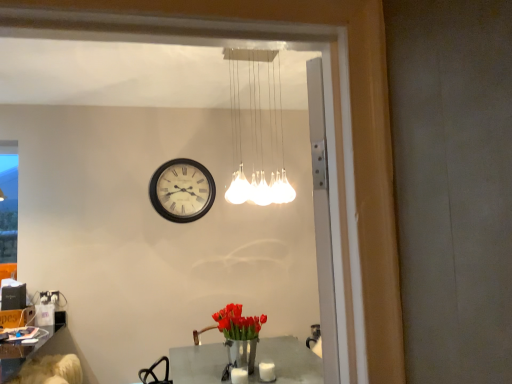
Question: From a real-world perspective, relative to metallic silver table at center, is matte black clock at center vertically above or below?

Choices:
 (A) below
 (B) above

Answer: (B)

Question: Is point 202,175 positioned closer to the camera than point 217,357?

Choices:
 (A) closer
 (B) farther

Answer: (B)

Question: Which object is positioned closest to the matte black clock at center?

Choices:
 (A) shiny metallic vase with red tulips at center
 (B) light brown leather swivel chair at lower left
 (C) white glass pendant lights at upper center
 (D) metallic silver table at center
 (E) white matte candle at lower center, placed as the second candle when sorted from left to right

Answer: (C)

Question: Which is farther from the white matte candle at lower center, the first candle in the left-to-right sequence?

Choices:
 (A) shiny metallic vase with red tulips at center
 (B) white matte candle at lower center, the first candle from the right
 (C) matte black clock at center
 (D) metallic silver table at center
 (E) white glass pendant lights at upper center

Answer: (E)